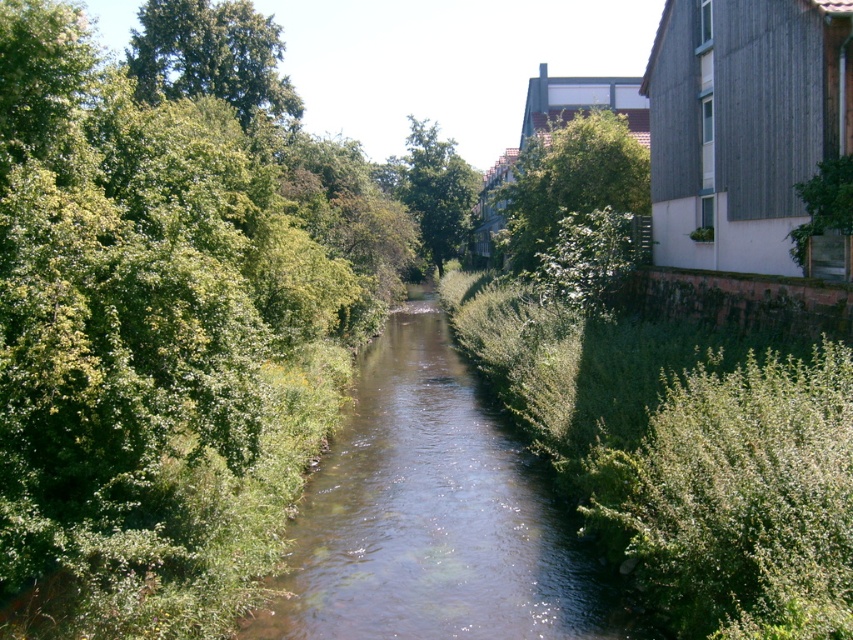
Question: Observing the image, what is the correct spatial positioning of green leafy tree at upper left in reference to green leafy tree at right?

Choices:
 (A) above
 (B) below

Answer: (A)

Question: Which point is closer to the camera?

Choices:
 (A) (389, 193)
 (B) (194, 20)
 (C) (206, 166)
 (D) (521, 195)

Answer: (C)

Question: Is green leafy tree at center in front of green leafy tree at right?

Choices:
 (A) no
 (B) yes

Answer: (A)

Question: Can you confirm if green leafy tree at left is positioned to the right of green leafy tree at upper left?

Choices:
 (A) yes
 (B) no

Answer: (A)

Question: Which object is farther from the camera taking this photo?

Choices:
 (A) green leafy tree at upper left
 (B) green leafy tree at right
 (C) green leafy tree at upper center

Answer: (A)

Question: Considering the real-world distances, which object is closest to the green leafy tree at upper center?

Choices:
 (A) green leafy tree at center
 (B) clear water at center

Answer: (B)